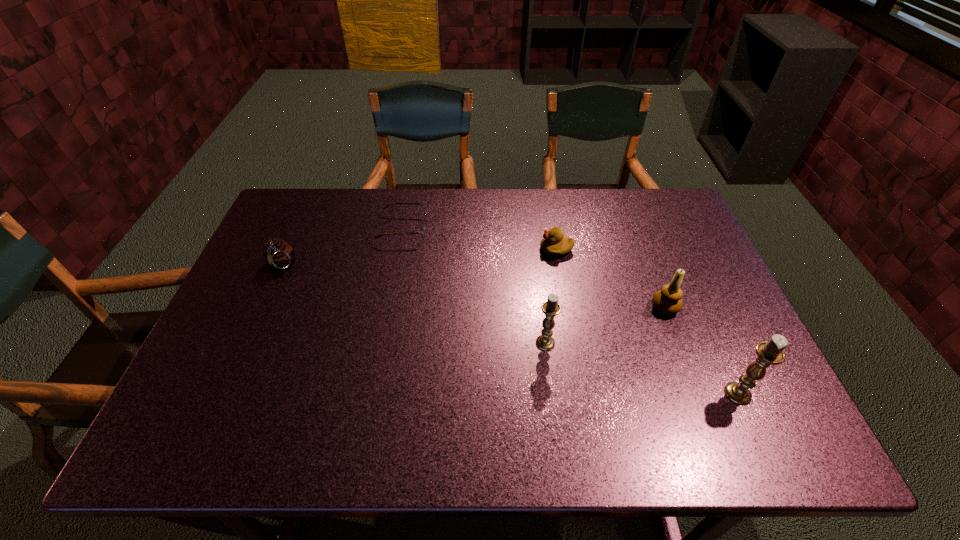
Choose which candle_holder is the second nearest neighbor to the leftmost object. Please provide its 2D coordinates. Your answer should be formatted as a tuple, i.e. [(x, y)], where the tuple contains the x and y coordinates of a point satisfying the conditions above.

[(668, 301)]

Where is `the closest candle_holder relative to the rightmost candle_holder`? The height and width of the screenshot is (540, 960). the closest candle_holder relative to the rightmost candle_holder is located at coordinates (668, 301).

The image size is (960, 540). What are the coordinates of `vacant area in the image that satisfies the following two spatial constraints: 1. on the front-facing side of the shortest object; 2. on the back side of the nearest object` in the screenshot? It's located at (372, 394).

The height and width of the screenshot is (540, 960). I want to click on free space that satisfies the following two spatial constraints: 1. on the front-facing side of the second tallest object; 2. on the left side of the fifth object from right to left, so click(381, 343).

Identify the location of vacant position in the image that satisfies the following two spatial constraints: 1. on the back side of the shortest candle_holder; 2. on the right side of the second nearest candle_holder. (540, 308).

Identify the location of vacant space that satisfies the following two spatial constraints: 1. on the front-facing side of the spectacles; 2. on the left side of the second object from right to left. (388, 308).

Locate an element on the screen. The height and width of the screenshot is (540, 960). vacant region that satisfies the following two spatial constraints: 1. on the front-facing side of the fifth tallest object; 2. on the left side of the third tallest object is located at coordinates pos(566,308).

Locate an element on the screen. This screenshot has height=540, width=960. vacant space that satisfies the following two spatial constraints: 1. on the front-facing side of the second shortest object; 2. on the right side of the nearest object is located at coordinates (582, 394).

In order to click on vacant position in the image that satisfies the following two spatial constraints: 1. on the front-facing side of the shortest object; 2. on the back side of the nearest object in this screenshot , I will do `click(372, 394)`.